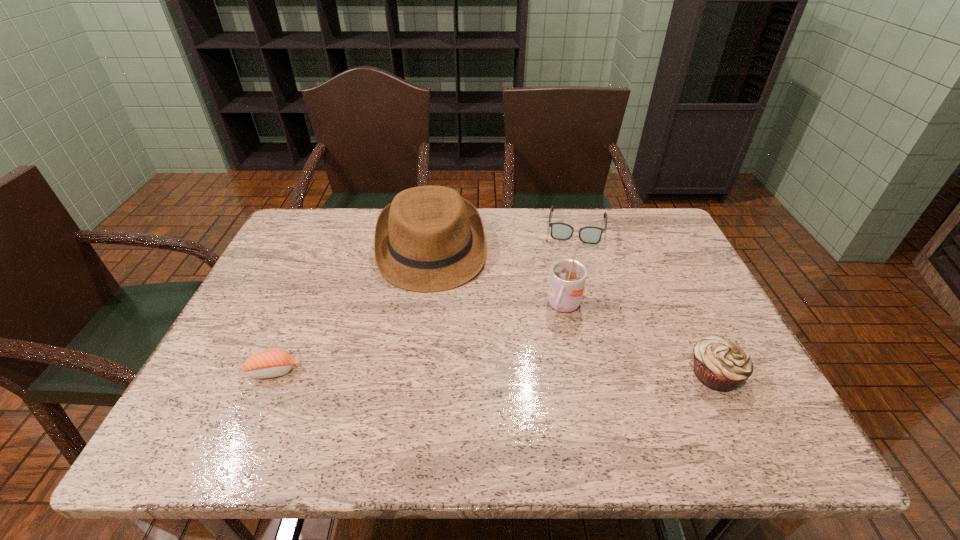
The width and height of the screenshot is (960, 540). I want to click on vacant region at the far right corner of the desktop, so click(663, 227).

This screenshot has width=960, height=540. I want to click on empty location between the spectacles and the fourth object from right to left, so click(x=504, y=238).

Identify the location of vacant area between the cup and the third tallest object. The height and width of the screenshot is (540, 960). (639, 341).

Where is `unoccupied area between the muffin and the second object from left to right`? unoccupied area between the muffin and the second object from left to right is located at coordinates (573, 311).

Locate an element on the screen. This screenshot has height=540, width=960. free space that is in between the cup and the leftmost object is located at coordinates (420, 339).

I want to click on free spot between the sushi and the fedora, so click(353, 310).

What are the coordinates of `vacant area between the spectacles and the third shortest object` in the screenshot? It's located at (646, 300).

The width and height of the screenshot is (960, 540). In order to click on vacant space that's between the cup and the fourth object from right to left in this screenshot , I will do (x=498, y=278).

You are a GUI agent. You are given a task and a screenshot of the screen. Output one action in this format:
    pyautogui.click(x=<x>, y=<y>)
    Task: Click on the vacant space that's between the spectacles and the third shortest object
    The width and height of the screenshot is (960, 540).
    Given the screenshot: What is the action you would take?
    pyautogui.click(x=646, y=300)

Select which object is the closest to the leftmost object. Please provide its 2D coordinates. Your answer should be formatted as a tuple, i.e. [(x, y)], where the tuple contains the x and y coordinates of a point satisfying the conditions above.

[(429, 239)]